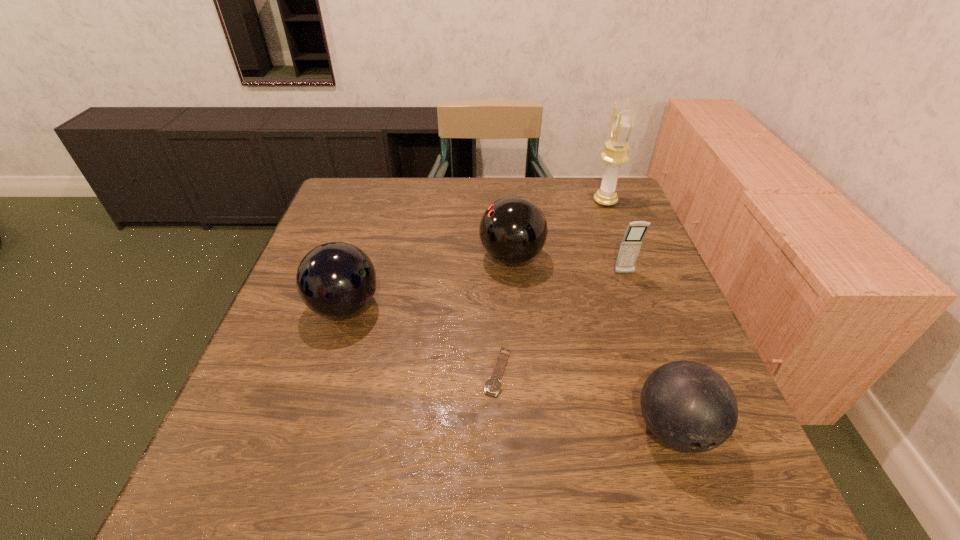
Image resolution: width=960 pixels, height=540 pixels. In the image, there is a desktop. Identify the location of vacant space at the near left corner. (221, 508).

Where is `free point at the far right corner`? free point at the far right corner is located at coordinates (578, 200).

Locate an element on the screen. This screenshot has width=960, height=540. free space between the third nearest object and the nearest bowling ball is located at coordinates click(x=510, y=368).

The height and width of the screenshot is (540, 960). Find the location of `free space between the award and the third nearest object`. free space between the award and the third nearest object is located at coordinates (475, 254).

The height and width of the screenshot is (540, 960). Identify the location of free point between the cellular telephone and the shortest object. tap(562, 322).

I want to click on vacant space that's between the leftmost bowling ball and the cellular telephone, so click(485, 290).

Locate an element on the screen. The height and width of the screenshot is (540, 960). vacant area that lies between the tallest object and the watch is located at coordinates (552, 286).

At what (x,y) coordinates should I click in order to perform the action: click on blank region between the rightmost bowling ball and the leftmost bowling ball. Please return your answer as a coordinate pair (x, y). The image size is (960, 540). Looking at the image, I should click on (510, 368).

At what (x,y) coordinates should I click in order to perform the action: click on free area in between the leftmost bowling ball and the farthest object. Please return your answer as a coordinate pair (x, y). The height and width of the screenshot is (540, 960). Looking at the image, I should click on (475, 254).

Locate an element on the screen. The image size is (960, 540). unoccupied position between the watch and the farthest bowling ball is located at coordinates (505, 314).